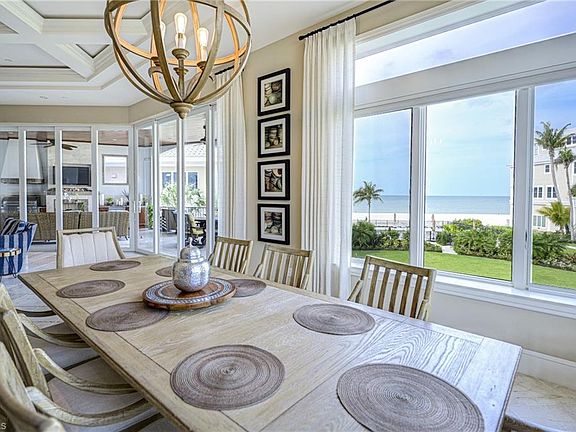
Where is `pictures`? The image size is (576, 432). pictures is located at coordinates coord(259,150).